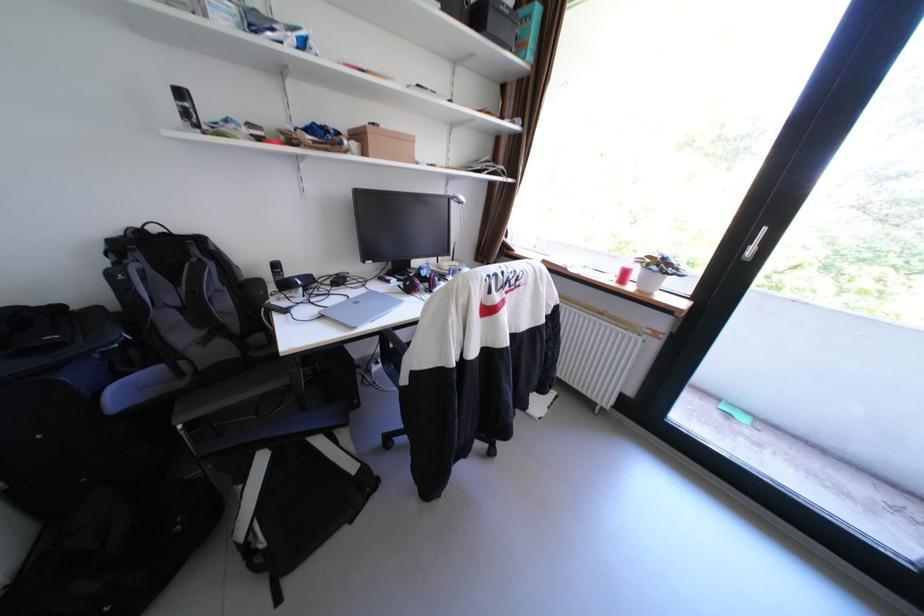
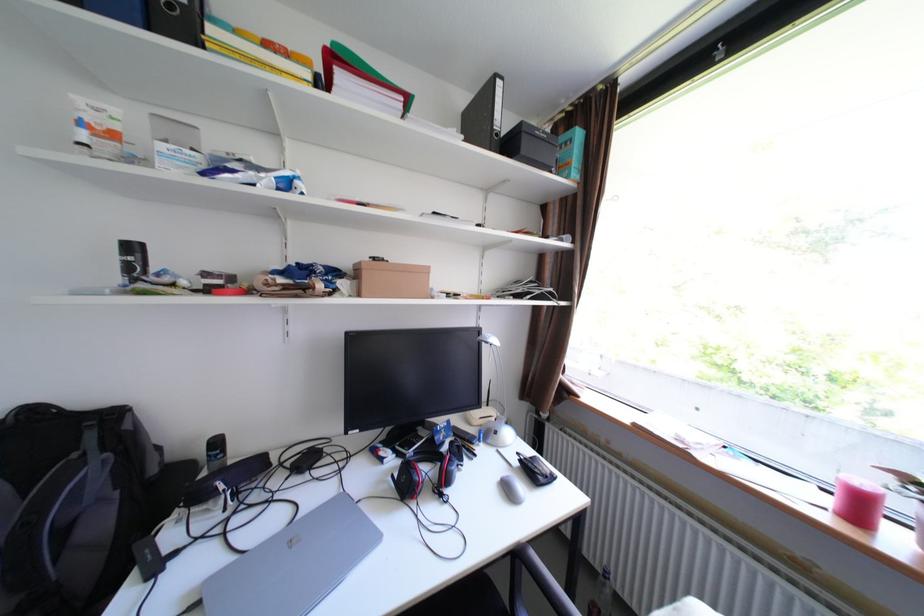
The point at (381, 138) is marked in the first image. Where is the corresponding point in the second image?

(375, 275)